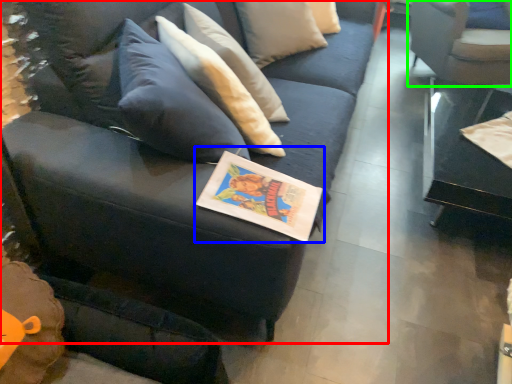
Question: Which object is positioned farthest from studio couch (highlighted by a red box)? Select from book (highlighted by a blue box) and chair (highlighted by a green box).

Choices:
 (A) book
 (B) chair

Answer: (B)